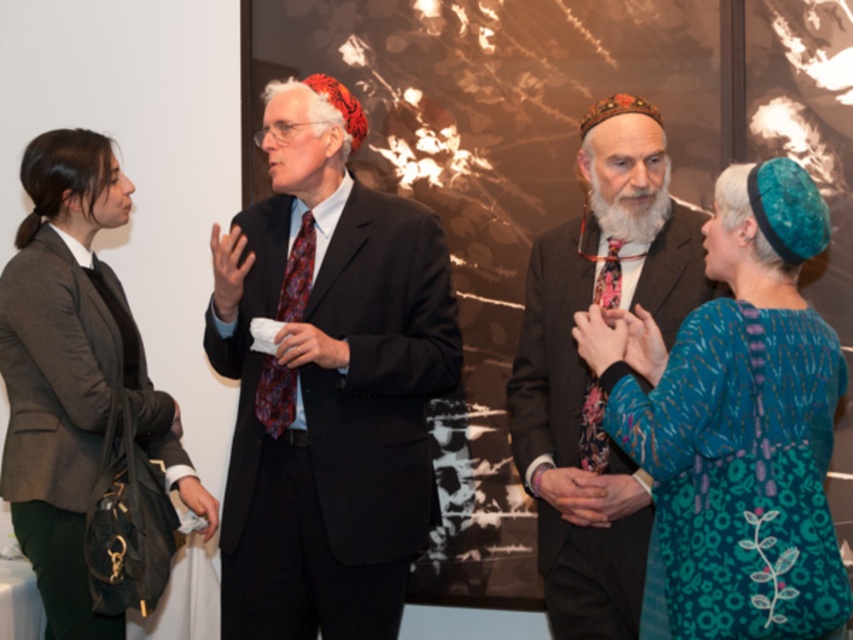
You are attending an event and want to take a photo of the matte black suit at center and the white soft beard at center. Which one should you focus on first if you want to capture both in one frame?

The matte black suit at center is located below the white soft beard at center, so you should focus on the white soft beard at center first to ensure both are in the frame.

In the scene shown: You are organizing a photo shoot and need to arrange two suits in the center of the frame. The matte black suit at center and the brown textured suit at center must be placed side by side. Given their sizes, which suit should you place on the left to ensure they both fit within the frame without overlapping?

The matte black suit at center is wider than the brown textured suit at center. To fit both suits side by side in the frame without overlapping, place the narrower brown textured suit at center on the left and the wider matte black suit at center next to it.